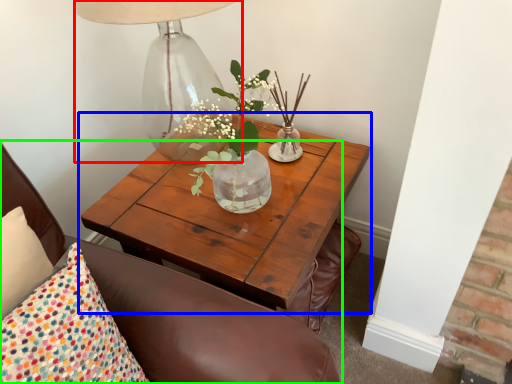
Question: Based on their relative distances, which object is farther from table lamp (highlighted by a red box)? Choose from coffee table (highlighted by a blue box) and chair (highlighted by a green box).

Choices:
 (A) coffee table
 (B) chair

Answer: (B)